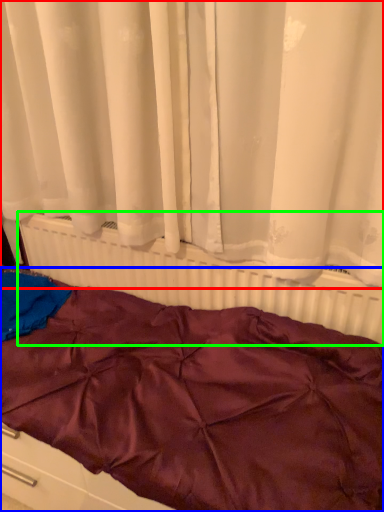
Question: Which object is positioned closest to curtain (highlighted by a red box)? Select from furniture (highlighted by a blue box) and radiator (highlighted by a green box).

Choices:
 (A) furniture
 (B) radiator

Answer: (B)